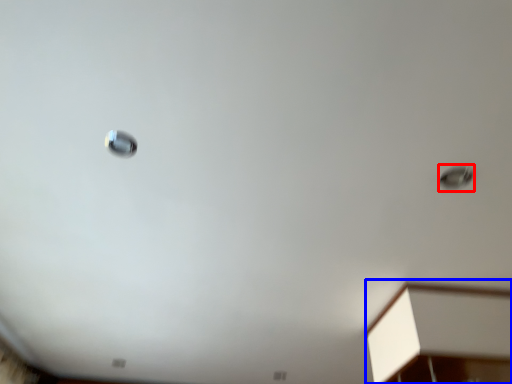
Question: Which object is closer to the camera taking this photo, droplight (highlighted by a red box) or furniture (highlighted by a blue box)?

Choices:
 (A) droplight
 (B) furniture

Answer: (A)